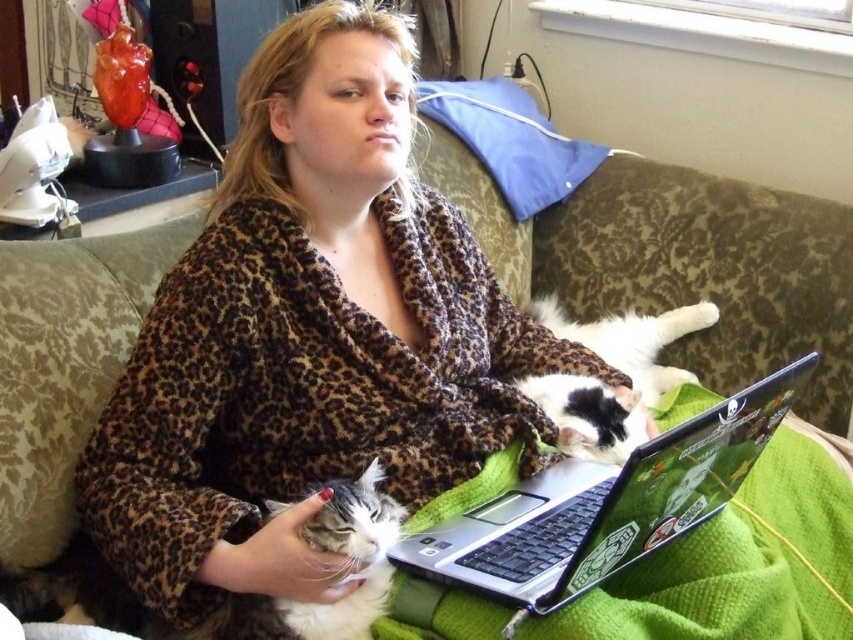
Which is above, silver/black plastic laptop at center or white fur cat at center?

Positioned higher is white fur cat at center.

Describe the element at coordinates (602, 506) in the screenshot. This screenshot has width=853, height=640. I see `silver/black plastic laptop at center` at that location.

Where is `silver/black plastic laptop at center`? Image resolution: width=853 pixels, height=640 pixels. silver/black plastic laptop at center is located at coordinates (602, 506).

Does leopard print robe at center have a smaller size compared to white fur cat at center?

Actually, leopard print robe at center might be larger than white fur cat at center.

Is leopard print robe at center in front of white fur cat at center?

Yes, it is.

Who is more forward, (408, 177) or (635, 388)?

Point (408, 177)

Find the location of a particular element. The height and width of the screenshot is (640, 853). leopard print robe at center is located at coordinates (310, 337).

Which is above, white fluffy cat at center or white and black fur cat at center?

white and black fur cat at center

Can you confirm if white fluffy cat at center is positioned to the left of white and black fur cat at center?

Yes, white fluffy cat at center is to the left of white and black fur cat at center.

Does point (367, 605) come in front of point (524, 381)?

That is True.

Where is `white fluffy cat at center`? This screenshot has width=853, height=640. white fluffy cat at center is located at coordinates (349, 557).